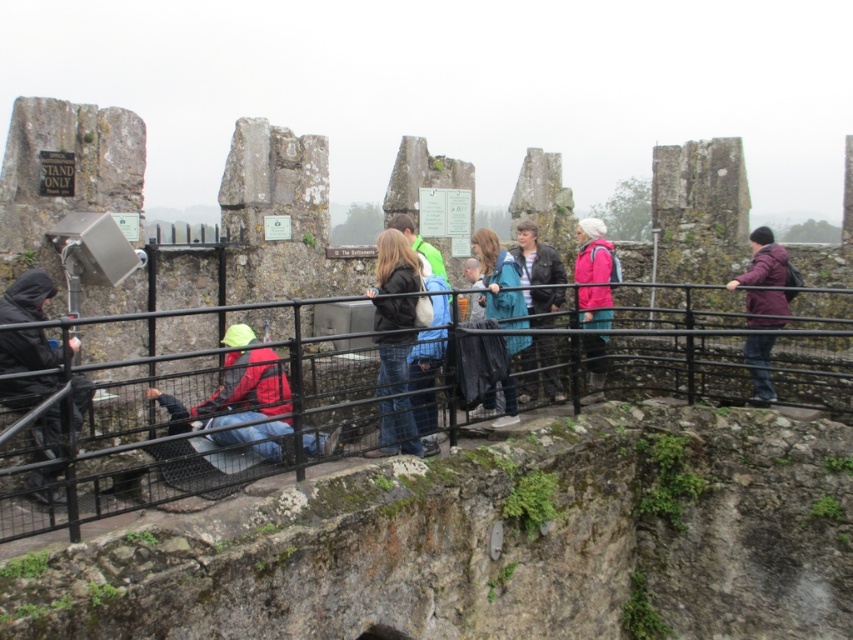
Does purple matte jacket at right have a larger size compared to teal fabric jacket at center?

Yes.

Is purple matte jacket at right shorter than teal fabric jacket at center?

Indeed, purple matte jacket at right has a lesser height compared to teal fabric jacket at center.

Which is in front, point (762, 268) or point (509, 291)?

Point (509, 291) is in front.

Where is `purple matte jacket at right`? The height and width of the screenshot is (640, 853). purple matte jacket at right is located at coordinates (763, 260).

Is point (492, 374) positioned before point (231, 364)?

That is True.

Can you confirm if black metal fence at lower left is positioned below red jacket at center?

No.

Who is more forward, (219, 387) or (234, 404)?

Point (234, 404)

Identify the location of black metal fence at lower left. (200, 451).

Is denim jacket at center above pink matte jacket at center?

No.

Which is in front, point (404, 244) or point (596, 324)?

Point (404, 244) is in front.

Is point (398, 257) more distant than point (590, 317)?

No, it is not.

Locate an element on the screen. Image resolution: width=853 pixels, height=640 pixels. denim jacket at center is located at coordinates (393, 282).